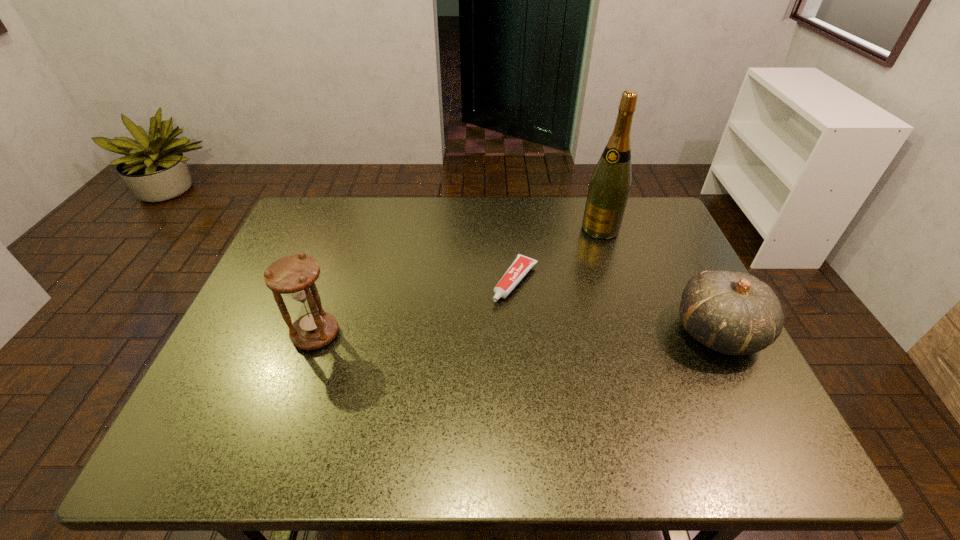
You are a GUI agent. You are given a task and a screenshot of the screen. Output one action in this format:
    pyautogui.click(x=<x>, y=<y>)
    Task: Click on the free spot located 0.240m on the front-facing side of the wine bottle
    
    Given the screenshot: What is the action you would take?
    point(556,284)

Identify the location of vacant space located 0.250m on the front-facing side of the wine bottle. The image size is (960, 540). (554, 286).

The width and height of the screenshot is (960, 540). In order to click on vacant area situated 0.280m on the front-facing side of the wine bottle in this screenshot , I will do `click(548, 292)`.

Image resolution: width=960 pixels, height=540 pixels. Find the location of `free space located 0.070m at the nozzle of the toothpaste`. free space located 0.070m at the nozzle of the toothpaste is located at coordinates (492, 320).

This screenshot has height=540, width=960. I want to click on free location located 0.210m at the nozzle of the toothpaste, so point(461,360).

Where is `free region located at the nozzle of the toothpaste`? The image size is (960, 540). free region located at the nozzle of the toothpaste is located at coordinates (441, 386).

This screenshot has width=960, height=540. Identify the location of object located in the far edge section of the desktop. (x=609, y=188).

This screenshot has height=540, width=960. I want to click on object that is at the left edge, so click(294, 275).

Where is `gourd that is at the right edge`? Image resolution: width=960 pixels, height=540 pixels. gourd that is at the right edge is located at coordinates (734, 313).

What are the coordinates of `wine bottle that is at the right edge` in the screenshot? It's located at (609, 188).